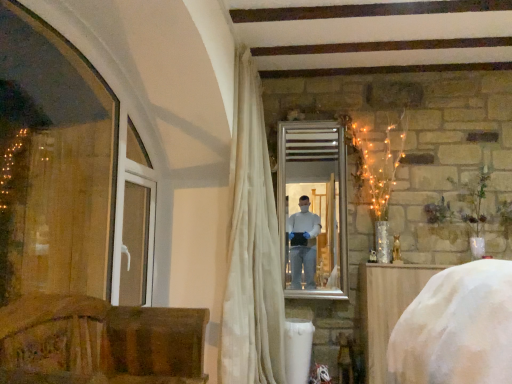
What is the approximate width of white sheer curtain at center?

It is 17.58 inches.

Based on the photo, what is the approximate height of white plastic window frame at left?

It is 31.60 inches.

At what (x,y) coordinates should I click in order to perform the action: click on white plastic window frame at left. Please return your answer as a coordinate pair (x, y). Image resolution: width=512 pixels, height=384 pixels. Looking at the image, I should click on (135, 224).

You are a GUI agent. You are given a task and a screenshot of the screen. Output one action in this format:
    pyautogui.click(x=<x>, y=<y>)
    Task: Click on the white fabric-covered object at lower right, the first furniture from the back
    This screenshot has width=512, height=384.
    Given the screenshot: What is the action you would take?
    pyautogui.click(x=385, y=307)

Identify the location of white sheer curtain at center. (252, 247).

Looking at this image, would you say silver/metallic mirror at center is outside wooden chair at lower left, positioned as the second furniture in right-to-left order?

silver/metallic mirror at center is positioned outside wooden chair at lower left, positioned as the second furniture in right-to-left order.

From the picture: From a real-world perspective, who is located lower, silver/metallic mirror at center or wooden chair at lower left, positioned as the second furniture in right-to-left order?

In real-world perspective, wooden chair at lower left, positioned as the second furniture in right-to-left order, is lower.

From the image's perspective, which is above, silver/metallic mirror at center or wooden chair at lower left, which is the 1th furniture in front-to-back order?

silver/metallic mirror at center is shown above in the image.

Which of these two, silver/metallic mirror at center or wooden chair at lower left, positioned as the second furniture in right-to-left order, stands shorter?

wooden chair at lower left, positioned as the second furniture in right-to-left order.

Between white fabric-covered object at lower right, which is counted as the 1th furniture, starting from the right, and white plastic window frame at left, which one has larger size?

white fabric-covered object at lower right, which is counted as the 1th furniture, starting from the right.

From a real-world perspective, is white fabric-covered object at lower right, which is the second furniture in front-to-back order, located higher than white plastic window frame at left?

Incorrect, from a real-world perspective, white fabric-covered object at lower right, which is the second furniture in front-to-back order, is lower than white plastic window frame at left.

Consider the image. How different are the orientations of white fabric-covered object at lower right, which is the second furniture in front-to-back order, and white plastic window frame at left in degrees?

The angle between the facing direction of white fabric-covered object at lower right, which is the second furniture in front-to-back order, and the facing direction of white plastic window frame at left is 89.9 degrees.

From the picture: From the image's perspective, which is below, white fabric-covered object at lower right, positioned as the second furniture in left-to-right order, or white plastic window frame at left?

white fabric-covered object at lower right, positioned as the second furniture in left-to-right order.

Is silver/metallic mirror at center looking in the opposite direction of white fabric-covered object at lower right, positioned as the second furniture in left-to-right order?

No, silver/metallic mirror at center's orientation is not away from white fabric-covered object at lower right, positioned as the second furniture in left-to-right order.

Can you confirm if silver/metallic mirror at center is bigger than white fabric-covered object at lower right, which is the second furniture in front-to-back order?

Actually, silver/metallic mirror at center might be smaller than white fabric-covered object at lower right, which is the second furniture in front-to-back order.

How many degrees apart are the facing directions of silver/metallic mirror at center and white fabric-covered object at lower right, which is counted as the 1th furniture, starting from the right?

silver/metallic mirror at center and white fabric-covered object at lower right, which is counted as the 1th furniture, starting from the right, are facing 0.763 degrees away from each other.

Can white fabric-covered object at lower right, which is the second furniture in front-to-back order, be found inside silver/metallic mirror at center?

No.

Does wooden chair at lower left, placed as the first furniture when sorted from left to right, appear on the right side of silver/metallic mirror at center?

Incorrect, wooden chair at lower left, placed as the first furniture when sorted from left to right, is not on the right side of silver/metallic mirror at center.

Does point (142, 364) appear closer or farther from the camera than point (328, 253)?

Point (142, 364).

From the image's perspective, relative to silver/metallic mirror at center, is wooden chair at lower left, which is the 1th furniture in front-to-back order, above or below?

Based on their image positions, wooden chair at lower left, which is the 1th furniture in front-to-back order, is located beneath silver/metallic mirror at center.

Is wooden chair at lower left, positioned as the second furniture in right-to-left order, surrounded by white sheer curtain at center?

That's incorrect, wooden chair at lower left, positioned as the second furniture in right-to-left order, is not inside white sheer curtain at center.

How much distance is there between white sheer curtain at center and wooden chair at lower left, positioned as the second furniture in right-to-left order?

34.71 inches.

From a real-world perspective, is white sheer curtain at center below wooden chair at lower left, placed as the first furniture when sorted from left to right?

No, from a real-world perspective, white sheer curtain at center is not under wooden chair at lower left, placed as the first furniture when sorted from left to right.

Could you tell me if white sheer curtain at center is facing wooden chair at lower left, positioned as the second furniture in right-to-left order?

No, white sheer curtain at center does not turn towards wooden chair at lower left, positioned as the second furniture in right-to-left order.

Between wooden chair at lower left, placed as the first furniture when sorted from left to right, and white plastic window frame at left, which one has less height?

wooden chair at lower left, placed as the first furniture when sorted from left to right, is shorter.

In the scene shown: Is wooden chair at lower left, the second furniture viewed from the back, next to white plastic window frame at left and touching it?

No, wooden chair at lower left, the second furniture viewed from the back, is not next to white plastic window frame at left.

Is wooden chair at lower left, which is the 1th furniture in front-to-back order, inside the boundaries of white plastic window frame at left, or outside?

wooden chair at lower left, which is the 1th furniture in front-to-back order, is located beyond the bounds of white plastic window frame at left.

Would you say wooden chair at lower left, placed as the first furniture when sorted from left to right, is to the left or to the right of white plastic window frame at left in the picture?

In the image, wooden chair at lower left, placed as the first furniture when sorted from left to right, appears on the right side of white plastic window frame at left.

Is there a large distance between white sheer curtain at center and silver/metallic mirror at center?

They are positioned close to each other.

Which point is more forward, (260, 209) or (342, 282)?

Positioned in front is point (260, 209).

Can you confirm if white sheer curtain at center is positioned to the right of silver/metallic mirror at center?

No, white sheer curtain at center is not to the right of silver/metallic mirror at center.

From the image's perspective, relative to silver/metallic mirror at center, is white sheer curtain at center above or below?

Clearly, from the image's perspective, white sheer curtain at center is below silver/metallic mirror at center.

Where is `the 1st furniture below the silver/metallic mirror at center (from a real-world perspective)`? This screenshot has height=384, width=512. the 1st furniture below the silver/metallic mirror at center (from a real-world perspective) is located at coordinates (99, 342).

Where is `window frame that appears in front of the white fabric-covered object at lower right, which is counted as the 1th furniture, starting from the right`? Image resolution: width=512 pixels, height=384 pixels. window frame that appears in front of the white fabric-covered object at lower right, which is counted as the 1th furniture, starting from the right is located at coordinates (135, 224).

Based on their spatial positions, is white plastic window frame at left or wooden chair at lower left, placed as the first furniture when sorted from left to right, closer to white fabric-covered object at lower right, which is the second furniture in front-to-back order?

wooden chair at lower left, placed as the first furniture when sorted from left to right, lies closer to white fabric-covered object at lower right, which is the second furniture in front-to-back order, than the other object.

Looking at the image, which one is located closer to white plastic window frame at left, white sheer curtain at center or wooden chair at lower left, positioned as the second furniture in right-to-left order?

white sheer curtain at center.

When comparing their distances from white sheer curtain at center, does white plastic window frame at left or silver/metallic mirror at center seem further?

Based on the image, white plastic window frame at left appears to be further to white sheer curtain at center.

Based on their spatial positions, is white plastic window frame at left or white sheer curtain at center closer to wooden chair at lower left, which is the 1th furniture in front-to-back order?

The object closer to wooden chair at lower left, which is the 1th furniture in front-to-back order, is white sheer curtain at center.

Which object lies further to the anchor point white fabric-covered object at lower right, the first furniture from the back, white sheer curtain at center or white plastic window frame at left?

white plastic window frame at left is further to white fabric-covered object at lower right, the first furniture from the back.

From the image, which object appears to be nearer to white sheer curtain at center, wooden chair at lower left, which is the 1th furniture in front-to-back order, or white fabric-covered object at lower right, positioned as the second furniture in left-to-right order?

white fabric-covered object at lower right, positioned as the second furniture in left-to-right order, is positioned closer to the anchor white sheer curtain at center.

Estimate the real-world distances between objects in this image. Which object is further from white fabric-covered object at lower right, which is counted as the 1th furniture, starting from the right, wooden chair at lower left, which is the 1th furniture in front-to-back order, or white plastic window frame at left?

white plastic window frame at left is further to white fabric-covered object at lower right, which is counted as the 1th furniture, starting from the right.

From the image, which object appears to be nearer to white sheer curtain at center, wooden chair at lower left, the second furniture viewed from the back, or white plastic window frame at left?

Among the two, white plastic window frame at left is located nearer to white sheer curtain at center.

Locate an element on the screen. furniture positioned between wooden chair at lower left, placed as the first furniture when sorted from left to right, and silver/metallic mirror at center from near to far is located at coordinates (385, 307).

Where is `curtain between white plastic window frame at left and silver/metallic mirror at center from left to right`? The width and height of the screenshot is (512, 384). curtain between white plastic window frame at left and silver/metallic mirror at center from left to right is located at coordinates (252, 247).

The height and width of the screenshot is (384, 512). What are the coordinates of `mirror between white plastic window frame at left and white fabric-covered object at lower right, which is counted as the 1th furniture, starting from the right, in the horizontal direction` in the screenshot? It's located at (313, 208).

The width and height of the screenshot is (512, 384). I want to click on curtain positioned between wooden chair at lower left, the second furniture viewed from the back, and white plastic window frame at left from near to far, so click(x=252, y=247).